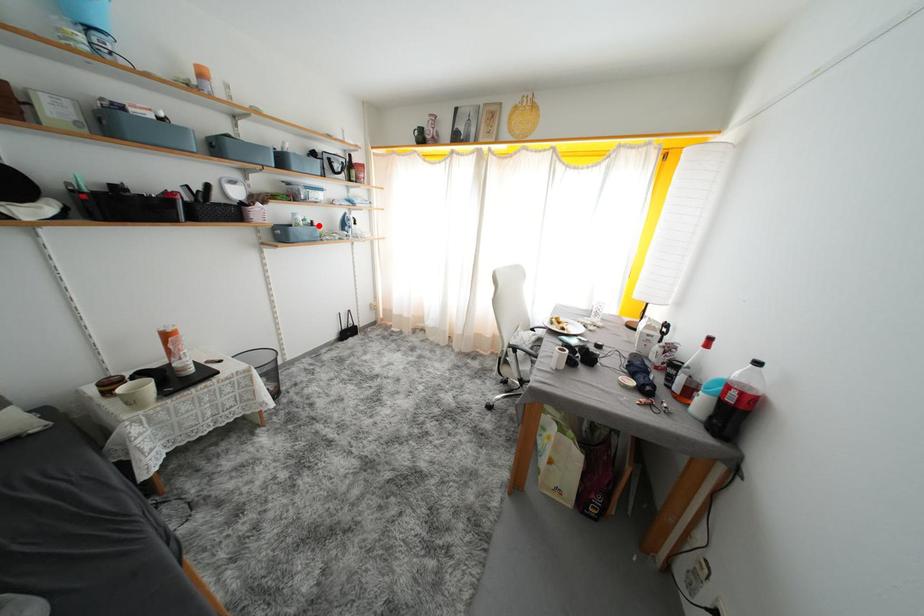
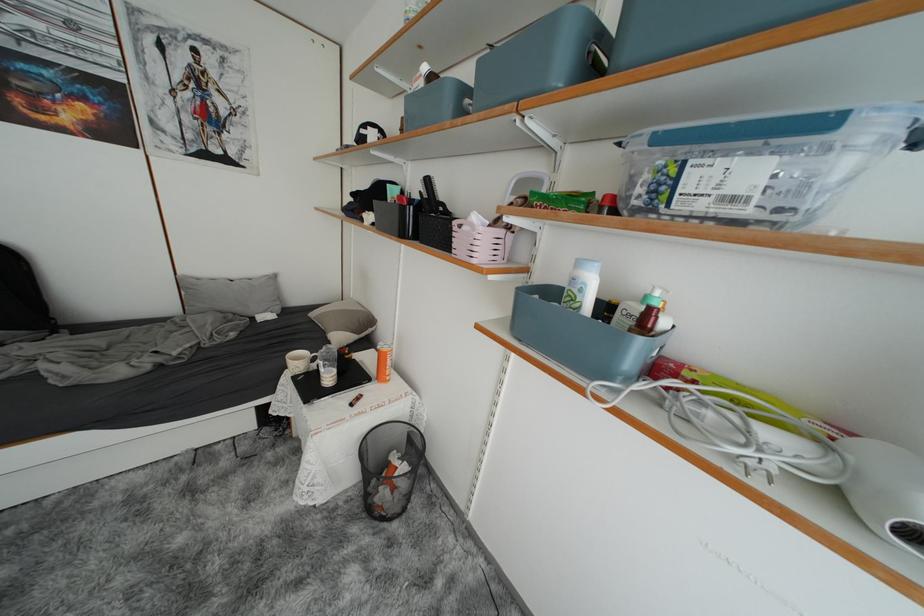
Locate, in the second image, the point that corresponds to the highlighted location in the first image.

(657, 315)